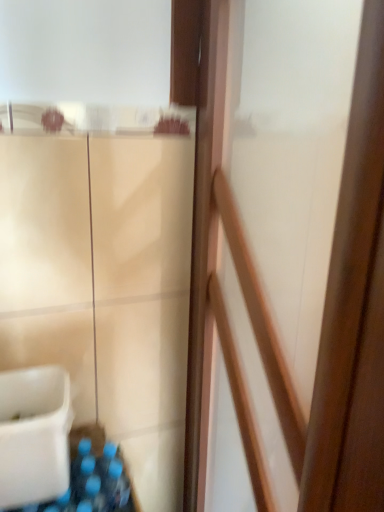
Question: From the image's perspective, relative to white plastic sink at lower left, is wooden screen door at center above or below?

Choices:
 (A) above
 (B) below

Answer: (A)

Question: Choose the correct answer: Is wooden screen door at center inside white plastic sink at lower left or outside it?

Choices:
 (A) outside
 (B) inside

Answer: (A)

Question: Is wooden screen door at center wider or thinner than white plastic sink at lower left?

Choices:
 (A) wide
 (B) thin

Answer: (B)

Question: Is white plastic sink at lower left in front of or behind wooden screen door at center in the image?

Choices:
 (A) front
 (B) behind

Answer: (B)

Question: In the image, is white plastic sink at lower left on the left side or the right side of wooden screen door at center?

Choices:
 (A) right
 (B) left

Answer: (B)

Question: Is white plastic sink at lower left inside or outside of wooden screen door at center?

Choices:
 (A) inside
 (B) outside

Answer: (B)

Question: From a real-world perspective, is white plastic sink at lower left physically located above or below wooden screen door at center?

Choices:
 (A) below
 (B) above

Answer: (A)